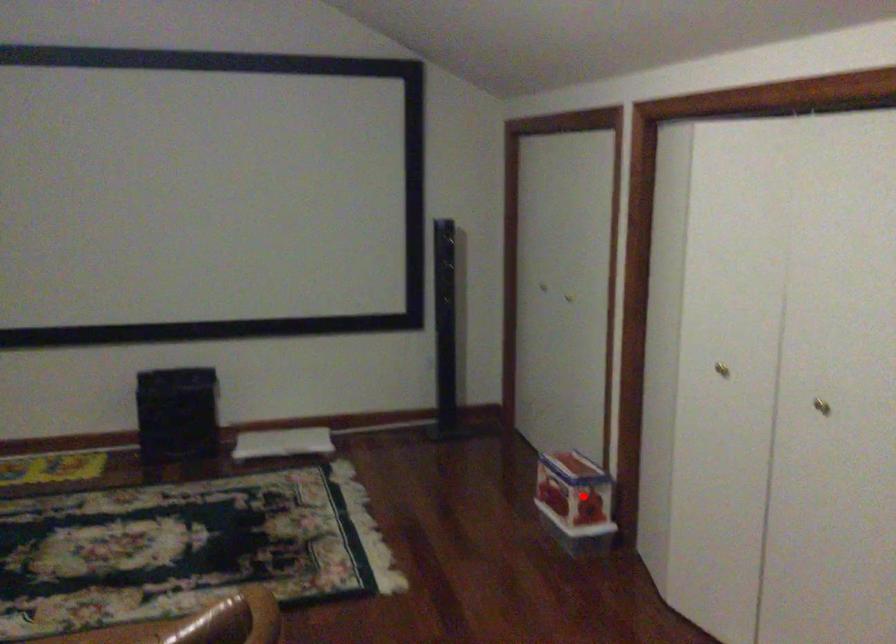
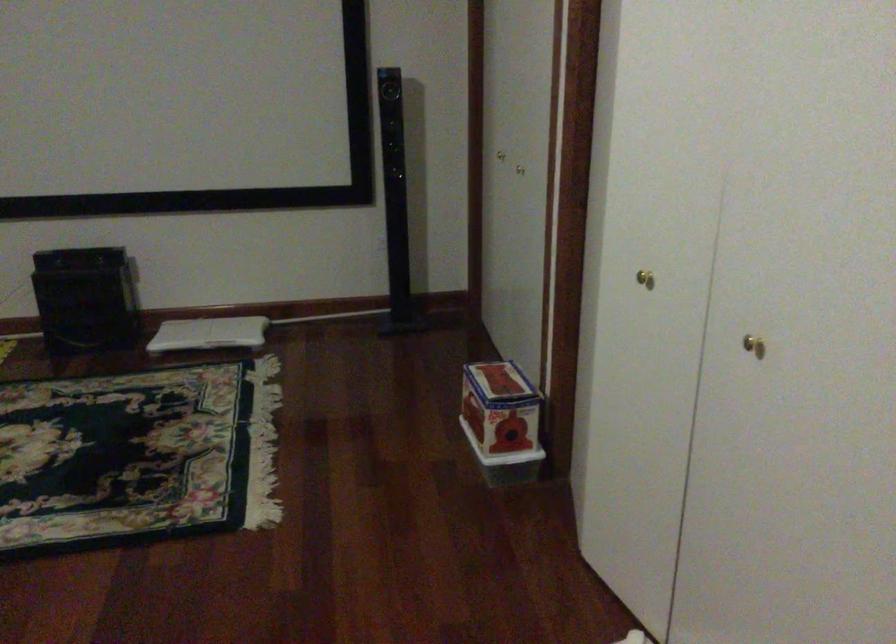
The point at the highlighted location is marked in the first image. Where is the corresponding point in the second image?

(501, 422)